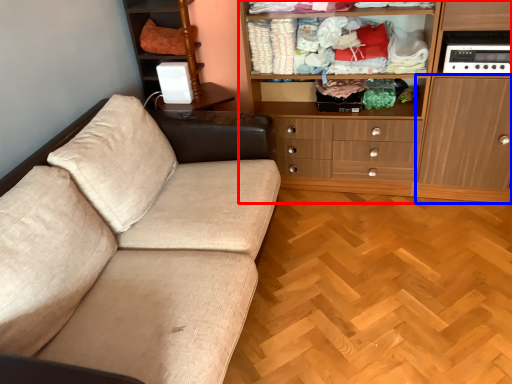
Question: Which point is further to the camera, cabinetry (highlighted by a red box) or cabinetry (highlighted by a blue box)?

Choices:
 (A) cabinetry
 (B) cabinetry

Answer: (A)